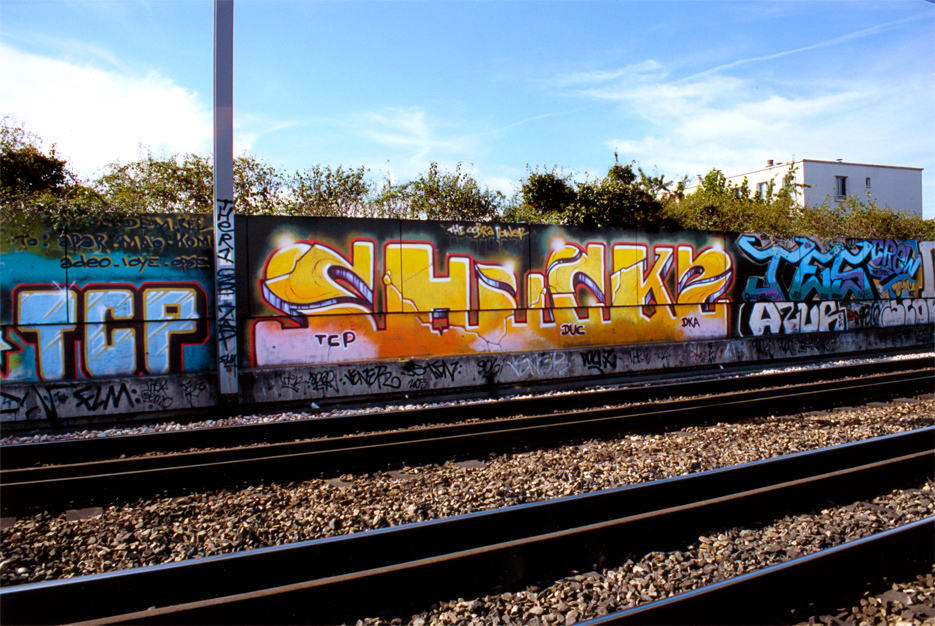
At what (x,y) coordinates should I click in order to perform the action: click on windows. Please return your answer as a coordinate pair (x, y). Looking at the image, I should click on (838, 195), (763, 192), (738, 188), (865, 183).